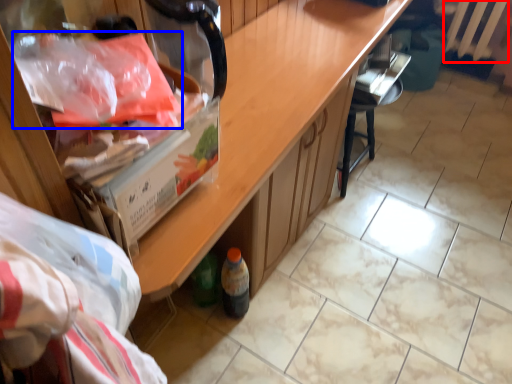
Question: Which of the following is the closest to the observer, radiator (highlighted by a red box) or material (highlighted by a blue box)?

Choices:
 (A) radiator
 (B) material

Answer: (B)